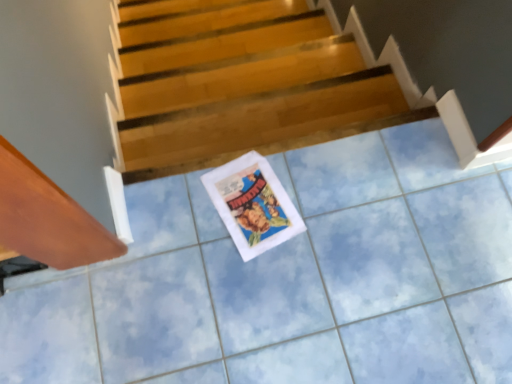
This screenshot has width=512, height=384. I want to click on vacant location below white paper comic book at center (from a real-world perspective), so click(x=254, y=206).